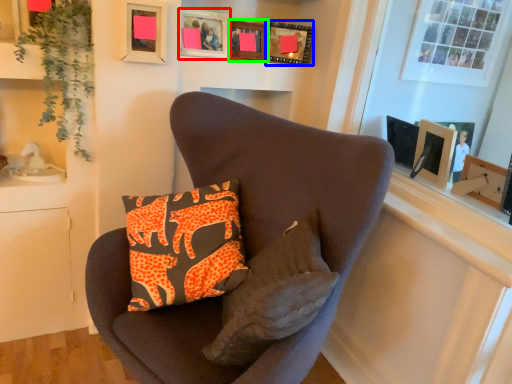
Question: Based on their relative distances, which object is farther from picture frame (highlighted by a red box)? Choose from picture frame (highlighted by a blue box) and picture frame (highlighted by a green box).

Choices:
 (A) picture frame
 (B) picture frame

Answer: (A)